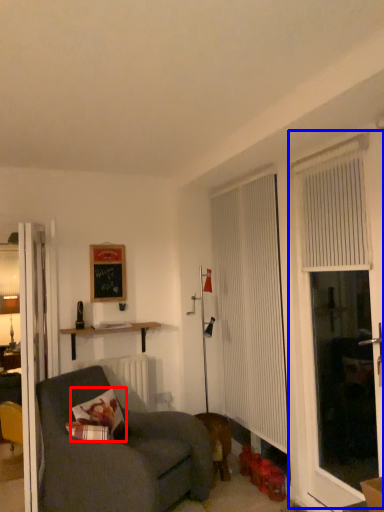
Question: Among these objects, which one is nearest to the camera, pillow (highlighted by a red box) or screen door (highlighted by a blue box)?

Choices:
 (A) pillow
 (B) screen door

Answer: (B)